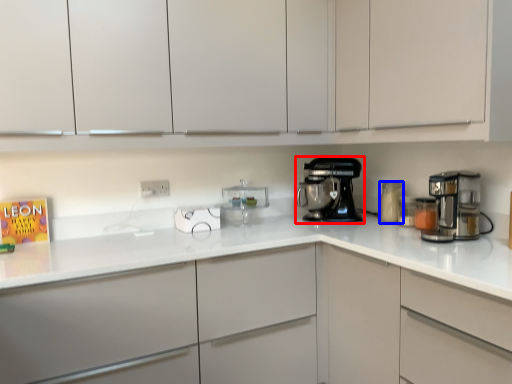
Question: Among these objects, which one is nearest to the camera, home appliance (highlighted by a red box) or kitchen appliance (highlighted by a blue box)?

Choices:
 (A) home appliance
 (B) kitchen appliance

Answer: (B)